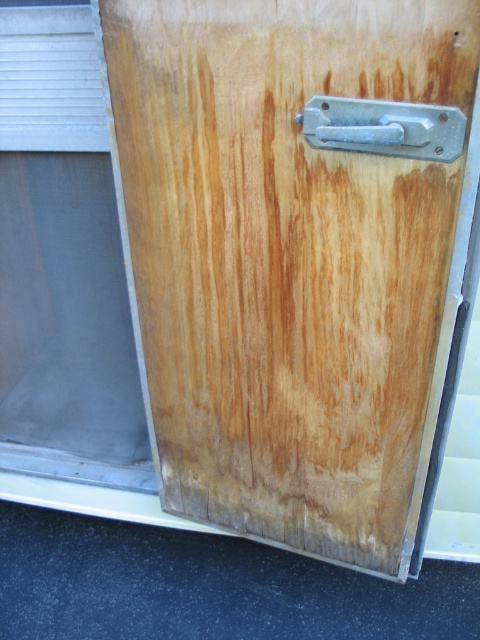
Between point (164, 244) and point (437, 144), which one is positioned behind?

The point (164, 244) is more distant.

Does point (120, 42) lie behind point (351, 106)?

That is True.

Describe the element at coordinates (298, 259) in the screenshot. The height and width of the screenshot is (640, 480). I see `natural wood door at center` at that location.

The width and height of the screenshot is (480, 640). Identify the location of natural wood door at center. (298, 259).

Is point (108, 38) positioned in front of point (100, 365)?

Yes, it is in front of point (100, 365).

Who is more distant from viewer, (387, 412) or (71, 138)?

Point (71, 138)

Is point (237, 250) positioned in front of point (55, 413)?

Yes, it is.

The image size is (480, 640). What are the coordinates of `natural wood door at center` in the screenshot? It's located at (298, 259).

Is transparent plastic window at upper left bigger than metallic silver door handle at upper center?

Correct, transparent plastic window at upper left is larger in size than metallic silver door handle at upper center.

Does transparent plastic window at upper left have a greater width compared to metallic silver door handle at upper center?

Yes, transparent plastic window at upper left is wider than metallic silver door handle at upper center.

Between point (48, 243) and point (301, 116), which one is positioned behind?

The point (48, 243) is behind.

You are a GUI agent. You are given a task and a screenshot of the screen. Output one action in this format:
    pyautogui.click(x=<x>, y=<y>)
    Task: Click on the transparent plastic window at upper left
    Image resolution: width=480 pixels, height=640 pixels.
    Given the screenshot: What is the action you would take?
    pyautogui.click(x=62, y=262)